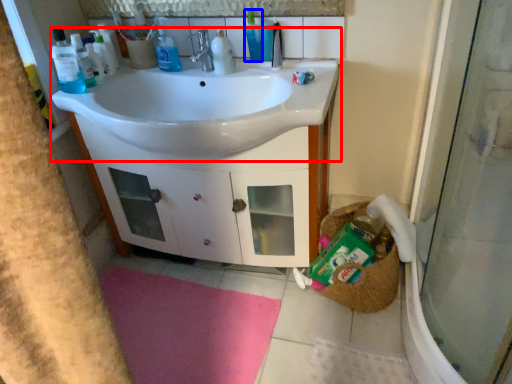
Question: Which of the following is the closest to the observer, sink (highlighted by a red box) or toiletry (highlighted by a blue box)?

Choices:
 (A) sink
 (B) toiletry

Answer: (A)